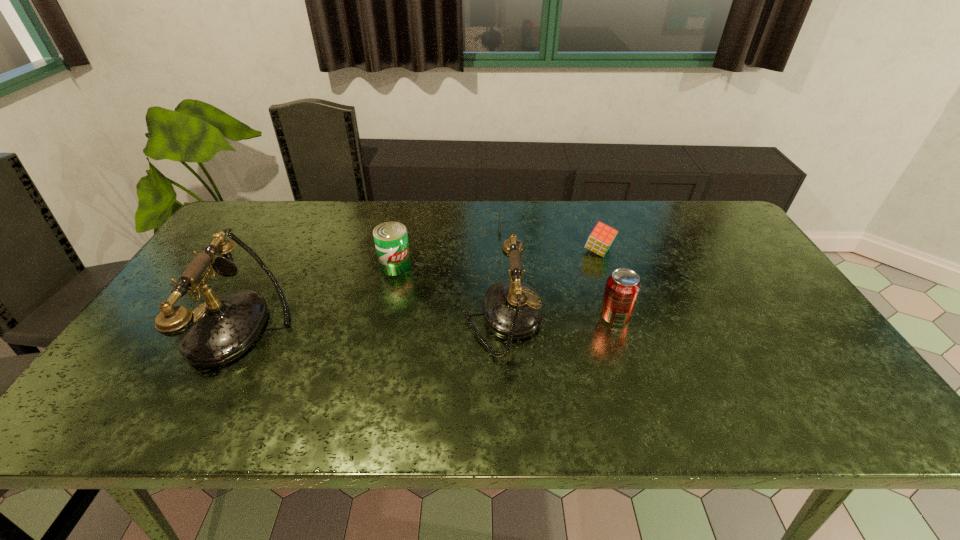
Find the location of a particular element. This screenshot has height=540, width=960. free space located 0.400m on the dial of the right telephone is located at coordinates (696, 319).

I want to click on free spot located 0.230m on the front of the fifth tallest object, so click(620, 318).

The image size is (960, 540). Identify the location of vacant space positioned 0.390m on the lenses of the farthest object. (380, 226).

The height and width of the screenshot is (540, 960). I want to click on vacant space located on the lenses of the farthest object, so click(411, 226).

Where is `vacant space situated on the lenses of the farthest object`? The height and width of the screenshot is (540, 960). vacant space situated on the lenses of the farthest object is located at coordinates (411, 226).

Identify the location of free spot located on the back of the soda can. The width and height of the screenshot is (960, 540). (606, 287).

Where is `free space located on the front of the can`? The height and width of the screenshot is (540, 960). free space located on the front of the can is located at coordinates (382, 324).

At what (x,y) coordinates should I click in order to perform the action: click on cube located at the far edge. Please return your answer as a coordinate pair (x, y). The width and height of the screenshot is (960, 540). Looking at the image, I should click on (599, 241).

This screenshot has width=960, height=540. I want to click on sunglasses present at the far edge, so click(512, 208).

The width and height of the screenshot is (960, 540). Find the location of `object present at the left edge`. object present at the left edge is located at coordinates (220, 330).